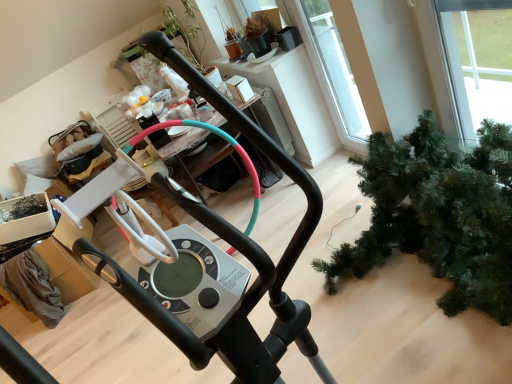
What do you see at coordinates (203, 257) in the screenshot? Image resolution: width=512 pixels, height=384 pixels. I see `metallic silver elliptical trainer at center` at bounding box center [203, 257].

Where is `metallic silver elliptical trainer at center`? This screenshot has height=384, width=512. metallic silver elliptical trainer at center is located at coordinates (203, 257).

The image size is (512, 384). Find the location of `green matte christmas tree at lower right`. green matte christmas tree at lower right is located at coordinates pos(439,215).

Describe the element at coordinates (439, 215) in the screenshot. Image resolution: width=512 pixels, height=384 pixels. I see `green matte christmas tree at lower right` at that location.

In order to face green matte christmas tree at lower right, should I rotate leftwards or rightwards?

Turn right by 21.374 degrees to look at green matte christmas tree at lower right.

Locate an element on the screen. The width and height of the screenshot is (512, 384). metallic silver elliptical trainer at center is located at coordinates (203, 257).

Which is more to the right, metallic silver elliptical trainer at center or green matte christmas tree at lower right?

Positioned to the right is green matte christmas tree at lower right.

Does metallic silver elliptical trainer at center come in front of green matte christmas tree at lower right?

Yes.

Is point (214, 93) positioned behind point (374, 263)?

No.

From the image's perspective, relative to green matte christmas tree at lower right, is metallic silver elliptical trainer at center above or below?

Based on their image positions, metallic silver elliptical trainer at center is located beneath green matte christmas tree at lower right.

From a real-world perspective, relative to green matte christmas tree at lower right, is metallic silver elliptical trainer at center vertically above or below?

From a real-world perspective, metallic silver elliptical trainer at center is physically above green matte christmas tree at lower right.

Which of these two, metallic silver elliptical trainer at center or green matte christmas tree at lower right, is thinner?

Thinner between the two is metallic silver elliptical trainer at center.

Between metallic silver elliptical trainer at center and green matte christmas tree at lower right, which one has more height?

With more height is metallic silver elliptical trainer at center.

Considering the sizes of objects metallic silver elliptical trainer at center and green matte christmas tree at lower right in the image provided, who is smaller, metallic silver elliptical trainer at center or green matte christmas tree at lower right?

With smaller size is green matte christmas tree at lower right.

Would you say metallic silver elliptical trainer at center is inside or outside green matte christmas tree at lower right?

metallic silver elliptical trainer at center is outside green matte christmas tree at lower right.

Are metallic silver elliptical trainer at center and green matte christmas tree at lower right far apart?

No, metallic silver elliptical trainer at center is not far away from green matte christmas tree at lower right.

Does metallic silver elliptical trainer at center turn towards green matte christmas tree at lower right?

No.

Can you tell me how much metallic silver elliptical trainer at center and green matte christmas tree at lower right differ in facing direction?

They differ by 71.9 degrees in their facing directions.

Measure the distance from metallic silver elliptical trainer at center to green matte christmas tree at lower right.

A distance of 38.43 inches exists between metallic silver elliptical trainer at center and green matte christmas tree at lower right.

Find the location of a particular element. Image resolution: width=512 pixels, height=384 pixels. sport equipment in front of the green matte christmas tree at lower right is located at coordinates (203, 257).

Visually, is green matte christmas tree at lower right positioned to the left or to the right of metallic silver elliptical trainer at center?

In the image, green matte christmas tree at lower right appears on the right side of metallic silver elliptical trainer at center.

Who is more distant, green matte christmas tree at lower right or metallic silver elliptical trainer at center?

green matte christmas tree at lower right is further away from the camera.

Does point (444, 273) appear closer or farther from the camera than point (67, 220)?

Point (444, 273) is positioned closer to the camera compared to point (67, 220).

From the image's perspective, which one is positioned higher, green matte christmas tree at lower right or metallic silver elliptical trainer at center?

green matte christmas tree at lower right appears higher in the image.

From a real-world perspective, which object rests below the other?

In real-world perspective, green matte christmas tree at lower right is lower.

Is green matte christmas tree at lower right thinner than metallic silver elliptical trainer at center?

In fact, green matte christmas tree at lower right might be wider than metallic silver elliptical trainer at center.

Is green matte christmas tree at lower right taller than metallic silver elliptical trainer at center?

In fact, green matte christmas tree at lower right may be shorter than metallic silver elliptical trainer at center.

Based on their sizes in the image, would you say green matte christmas tree at lower right is bigger or smaller than metallic silver elliptical trainer at center?

In the image, green matte christmas tree at lower right appears to be smaller than metallic silver elliptical trainer at center.

Is green matte christmas tree at lower right not within metallic silver elliptical trainer at center?

green matte christmas tree at lower right lies outside metallic silver elliptical trainer at center's area.

Would you say green matte christmas tree at lower right is a long distance from metallic silver elliptical trainer at center?

No, green matte christmas tree at lower right is not far from metallic silver elliptical trainer at center.

Could you tell me if green matte christmas tree at lower right is facing metallic silver elliptical trainer at center?

No, green matte christmas tree at lower right does not turn towards metallic silver elliptical trainer at center.

How far apart are green matte christmas tree at lower right and metallic silver elliptical trainer at center?

The distance of green matte christmas tree at lower right from metallic silver elliptical trainer at center is 38.43 inches.

Identify the location of houseplant that is under the metallic silver elliptical trainer at center (from a real-world perspective). (439, 215).

You are a GUI agent. You are given a task and a screenshot of the screen. Output one action in this format:
    pyautogui.click(x=<x>, y=<y>)
    Task: Click on the sport equipment that appears above the green matte christmas tree at lower right (from a real-world perspective)
    
    Given the screenshot: What is the action you would take?
    pyautogui.click(x=203, y=257)

In order to click on houseplant below the metallic silver elliptical trainer at center (from a real-world perspective) in this screenshot , I will do `click(439, 215)`.